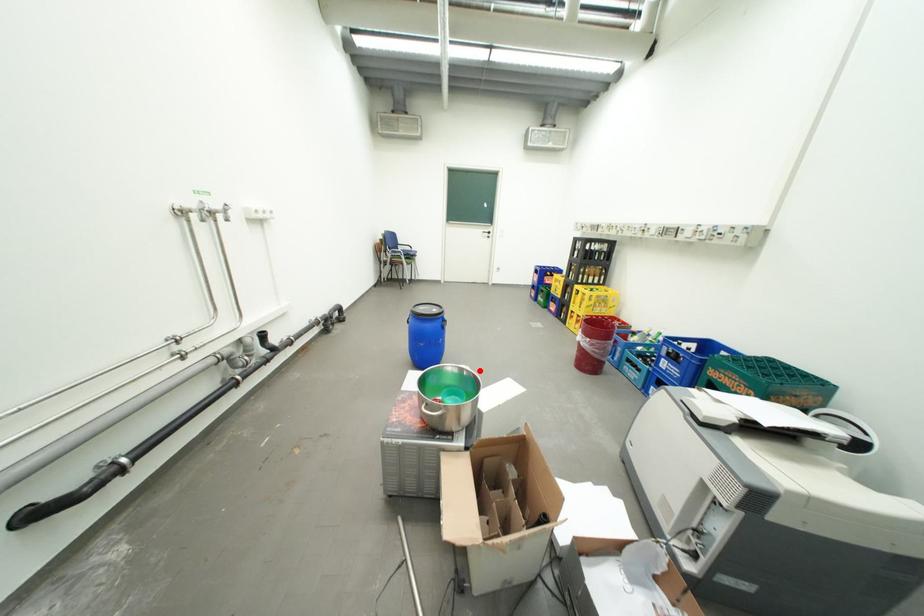
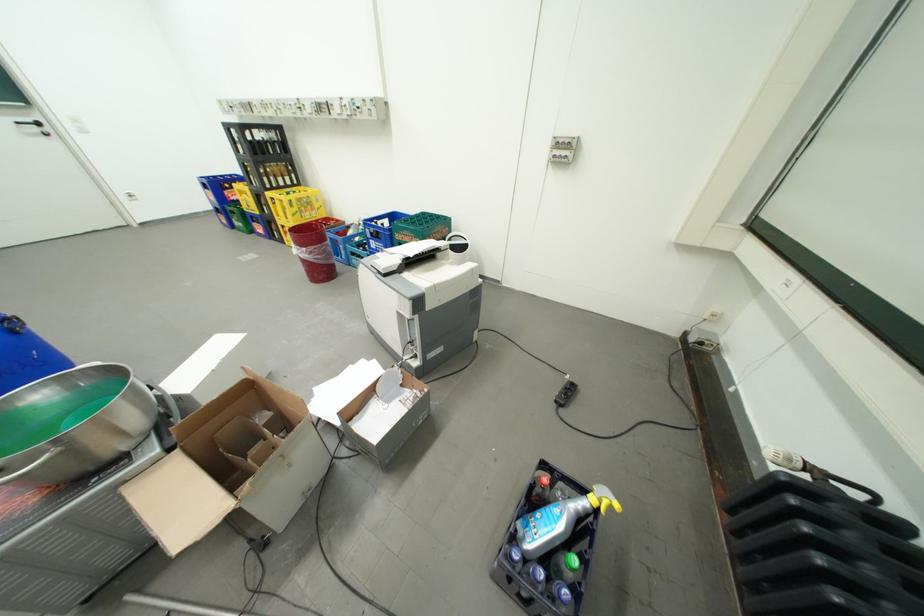
In the second image, find the point that corresponds to the highlighted location in the first image.

(108, 365)